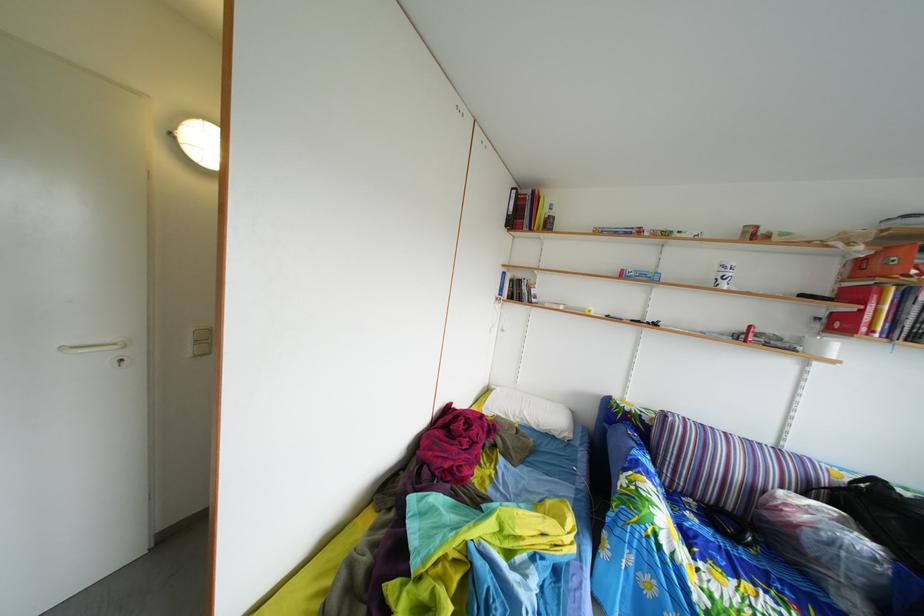
Find where to lift the plastic water bottle. Please return your answer as a coordinate pair (x, y).

(723, 275)